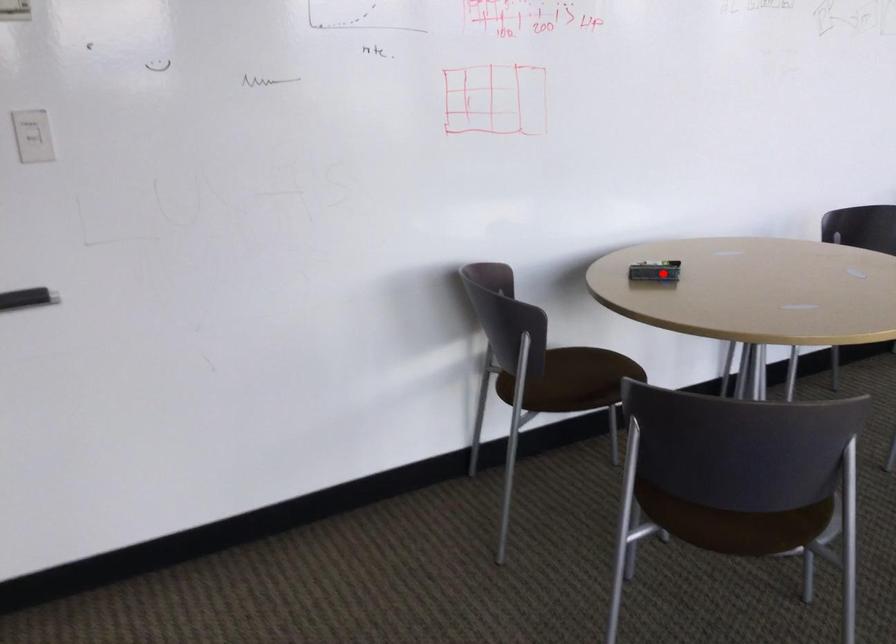
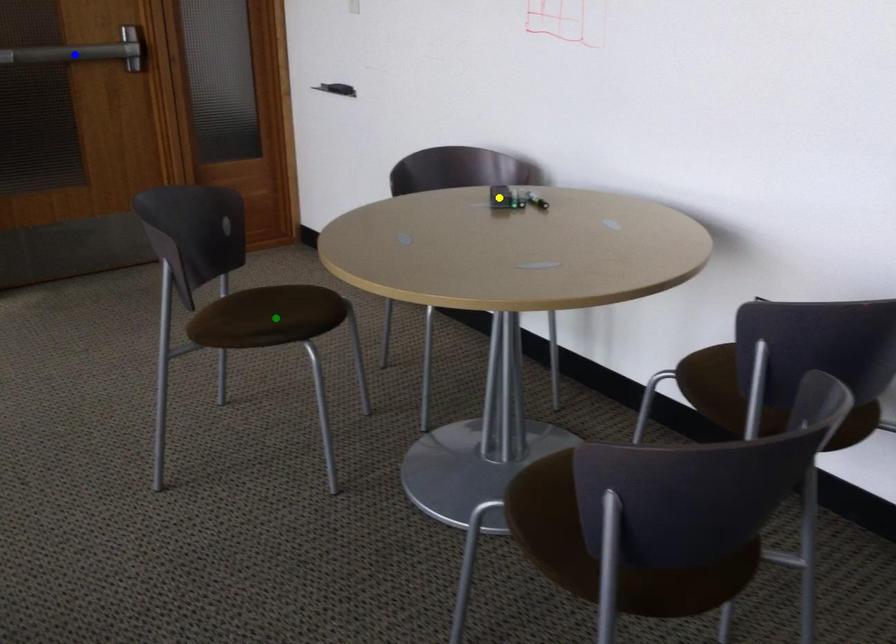
Question: I am providing you with two images of the same scene from different viewpoints. A red point is marked on the first image. You are given multiple points on the second image. In image 2, which mark is for the same physical point as the one in image 1?

Choices:
 (A) green point
 (B) blue point
 (C) yellow point

Answer: (C)